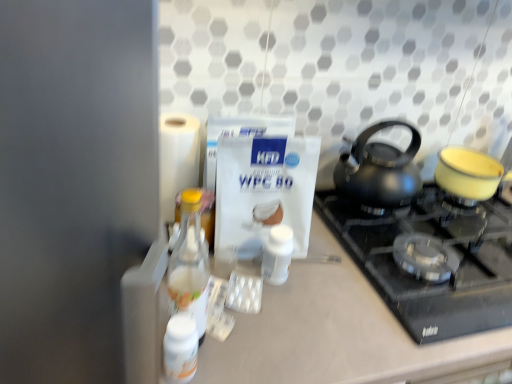
Identify the location of vacant space in between white glossy bottle at lower left, the 3th bottle in the right-to-left sequence, and white matte bottle at center, the 3th bottle viewed from the front. (238, 316).